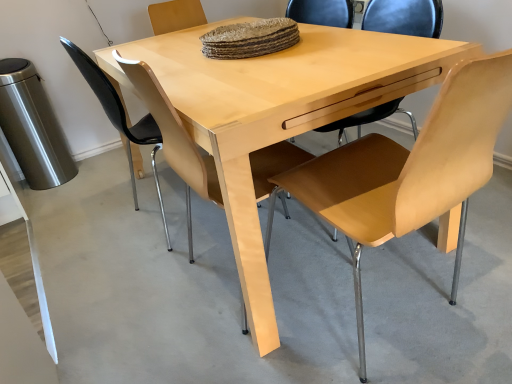
What is the approximate height of light brown leather chair at center, which is the 1th chair in left-to-right order?

It is 33.26 inches.

Identify the location of light brown leather chair at center, which is the 1th chair in left-to-right order. This screenshot has width=512, height=384. (120, 118).

Measure the distance between point (272, 41) and camera.

The depth of point (272, 41) is 1.50 meters.

You are a GUI agent. You are given a task and a screenshot of the screen. Output one action in this format:
    pyautogui.click(x=<x>, y=<y>)
    Task: Click on the light wood chair at center, the second chair in the left-to-right sequence
    Image resolution: width=512 pixels, height=384 pixels.
    Given the screenshot: What is the action you would take?
    pyautogui.click(x=175, y=138)

Is brown woven mat at center further to the viewer compared to light brown wood chair at center, which is counted as the 1th chair, starting from the right?

Yes, it is behind light brown wood chair at center, which is counted as the 1th chair, starting from the right.

Is light brown wood chair at center, the third chair when ordered from left to right, at the back of brown woven mat at center?

No, brown woven mat at center is not facing away from light brown wood chair at center, the third chair when ordered from left to right.

Would you say brown woven mat at center is inside or outside light brown wood chair at center, the third chair when ordered from left to right?

brown woven mat at center is not enclosed by light brown wood chair at center, the third chair when ordered from left to right.

What's the angular difference between brown woven mat at center and light brown wood chair at center, which is counted as the 1th chair, starting from the right,'s facing directions?

88.2 degrees.

Is brown woven mat at center positioned beyond the bounds of light brown leather chair at center, which is the 1th chair in left-to-right order?

Yes, brown woven mat at center is located beyond the bounds of light brown leather chair at center, which is the 1th chair in left-to-right order.

Considering the sizes of objects brown woven mat at center and light brown leather chair at center, which is the 1th chair in left-to-right order, in the image provided, who is thinner, brown woven mat at center or light brown leather chair at center, which is the 1th chair in left-to-right order,?

With smaller width is brown woven mat at center.

Which is less distant, (247, 30) or (157, 173)?

Point (247, 30) is closer to the camera than point (157, 173).

From the image's perspective, is light wood chair at center, the second chair in the left-to-right sequence, above light brown leather chair at center, the 3th chair viewed from the right?

No, from the image's perspective, light wood chair at center, the second chair in the left-to-right sequence, is not on top of light brown leather chair at center, the 3th chair viewed from the right.

Which object is positioned more to the right, light wood chair at center, the second chair in the left-to-right sequence, or light brown leather chair at center, the 3th chair viewed from the right?

light wood chair at center, the second chair in the left-to-right sequence, is more to the right.

Considering the relative sizes of light wood chair at center, the second chair in the left-to-right sequence, and light brown leather chair at center, the 3th chair viewed from the right, in the image provided, is light wood chair at center, the second chair in the left-to-right sequence, taller than light brown leather chair at center, the 3th chair viewed from the right,?

Indeed, light wood chair at center, the second chair in the left-to-right sequence, has a greater height compared to light brown leather chair at center, the 3th chair viewed from the right.

From the light brown leather chair at center, the 3th chair viewed from the right, count 1st chairs forward and point to it. Please provide its 2D coordinates.

[(175, 138)]

Consider the image. Which object is thinner, light wood chair at center, which is counted as the second chair, starting from the right, or light brown wood chair at center, which is counted as the 1th chair, starting from the right?

light wood chair at center, which is counted as the second chair, starting from the right, is thinner.

Could you measure the distance between light wood chair at center, which is counted as the second chair, starting from the right, and light brown wood chair at center, the third chair when ordered from left to right?

light wood chair at center, which is counted as the second chair, starting from the right, and light brown wood chair at center, the third chair when ordered from left to right, are 12.70 inches apart.

Between light wood chair at center, which is counted as the second chair, starting from the right, and light brown wood chair at center, which is counted as the 1th chair, starting from the right, which one has larger size?

light brown wood chair at center, which is counted as the 1th chair, starting from the right, is bigger.

Would you say light wood chair at center, which is counted as the second chair, starting from the right, is a long distance from light brown wood chair at center, which is counted as the 1th chair, starting from the right?

light wood chair at center, which is counted as the second chair, starting from the right, is near light brown wood chair at center, which is counted as the 1th chair, starting from the right, not far away.

Are light brown wood chair at center, the third chair when ordered from left to right, and light wood chair at center, which is counted as the second chair, starting from the right, beside each other?

No, light brown wood chair at center, the third chair when ordered from left to right, is not touching light wood chair at center, which is counted as the second chair, starting from the right.

Can we say light brown wood chair at center, which is counted as the 1th chair, starting from the right, lies outside light wood chair at center, the second chair in the left-to-right sequence?

Yes, light brown wood chair at center, which is counted as the 1th chair, starting from the right, is located beyond the bounds of light wood chair at center, the second chair in the left-to-right sequence.

In the image, is light brown wood chair at center, the third chair when ordered from left to right, positioned in front of or behind light wood chair at center, the second chair in the left-to-right sequence?

Clearly, light brown wood chair at center, the third chair when ordered from left to right, is in front of light wood chair at center, the second chair in the left-to-right sequence.

Is light brown leather chair at center, which is the 1th chair in left-to-right order, located within light wood table at center?

Yes, light brown leather chair at center, which is the 1th chair in left-to-right order, is a part of light wood table at center.

Is light wood table at center placed right next to light brown leather chair at center, which is the 1th chair in left-to-right order?

They are not placed beside each other.

From the image's perspective, which one is positioned lower, light wood table at center or light brown leather chair at center, which is the 1th chair in left-to-right order?

From the image's view, light wood table at center is below.

Considering the relative positions of light wood table at center and light brown leather chair at center, which is the 1th chair in left-to-right order, in the image provided, is light wood table at center to the right of light brown leather chair at center, which is the 1th chair in left-to-right order, from the viewer's perspective?

Indeed, light wood table at center is positioned on the right side of light brown leather chair at center, which is the 1th chair in left-to-right order.

From a real-world perspective, is light brown wood chair at center, the third chair when ordered from left to right, above or below brown woven mat at center?

Clearly, from a real-world perspective, light brown wood chair at center, the third chair when ordered from left to right, is below brown woven mat at center.

I want to click on chair on the right of brown woven mat at center, so click(409, 170).

Does light brown wood chair at center, which is counted as the 1th chair, starting from the right, have a lesser width compared to brown woven mat at center?

No.

What are the coordinates of `chair to the right of brown woven mat at center` in the screenshot? It's located at (409, 170).

Locate an element on the screen. food positioned vertically above the light brown leather chair at center, the 3th chair viewed from the right (from a real-world perspective) is located at coordinates (250, 39).

Based on their spatial positions, is light wood table at center or light brown leather chair at center, the 3th chair viewed from the right, further from light brown wood chair at center, which is counted as the 1th chair, starting from the right?

Based on the image, light brown leather chair at center, the 3th chair viewed from the right, appears to be further to light brown wood chair at center, which is counted as the 1th chair, starting from the right.

Considering their positions, is light wood chair at center, the second chair in the left-to-right sequence, positioned closer to light brown leather chair at center, which is the 1th chair in left-to-right order, than light brown wood chair at center, which is counted as the 1th chair, starting from the right?

light wood chair at center, the second chair in the left-to-right sequence, lies closer to light brown leather chair at center, which is the 1th chair in left-to-right order, than the other object.

From the image, which object appears to be nearer to light brown leather chair at center, which is the 1th chair in left-to-right order, brown woven mat at center or light wood table at center?

light wood table at center.

Based on their spatial positions, is light wood chair at center, the second chair in the left-to-right sequence, or light brown leather chair at center, the 3th chair viewed from the right, further from brown woven mat at center?

light brown leather chair at center, the 3th chair viewed from the right.

Looking at the image, which one is located closer to light wood chair at center, the second chair in the left-to-right sequence, brown woven mat at center or light wood table at center?

light wood table at center lies closer to light wood chair at center, the second chair in the left-to-right sequence, than the other object.

Looking at the image, which one is located closer to light wood chair at center, which is counted as the second chair, starting from the right, light wood table at center or brown woven mat at center?

light wood table at center is positioned closer to the anchor light wood chair at center, which is counted as the second chair, starting from the right.

Estimate the real-world distances between objects in this image. Which object is closer to light brown leather chair at center, the 3th chair viewed from the right, light wood chair at center, the second chair in the left-to-right sequence, or light wood table at center?

light wood table at center.

Estimate the real-world distances between objects in this image. Which object is closer to light wood chair at center, which is counted as the second chair, starting from the right, light brown leather chair at center, the 3th chair viewed from the right, or light wood table at center?

light wood table at center.

What are the coordinates of `table between light wood chair at center, which is counted as the second chair, starting from the right, and brown woven mat at center in the front-back direction` in the screenshot? It's located at (277, 111).

This screenshot has width=512, height=384. In order to click on table located between light wood chair at center, the second chair in the left-to-right sequence, and light brown wood chair at center, which is counted as the 1th chair, starting from the right, in the left-right direction in this screenshot , I will do `click(277, 111)`.

Where is `table positioned between light brown wood chair at center, the third chair when ordered from left to right, and brown woven mat at center from near to far`? This screenshot has width=512, height=384. table positioned between light brown wood chair at center, the third chair when ordered from left to right, and brown woven mat at center from near to far is located at coordinates (277, 111).

Where is `chair situated between light brown leather chair at center, the 3th chair viewed from the right, and light brown wood chair at center, the third chair when ordered from left to right, from left to right`? This screenshot has height=384, width=512. chair situated between light brown leather chair at center, the 3th chair viewed from the right, and light brown wood chair at center, the third chair when ordered from left to right, from left to right is located at coordinates (175, 138).